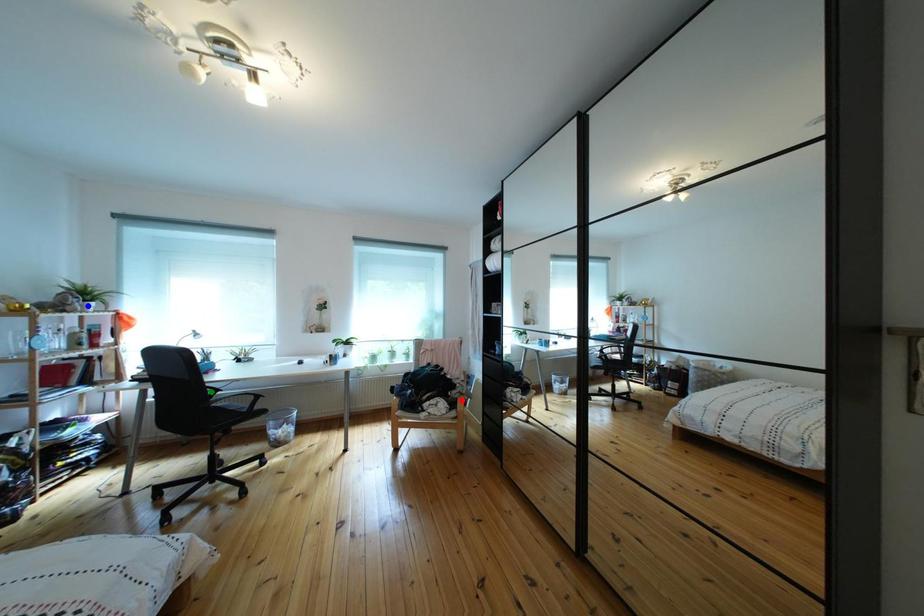
Order these from nearest to farthest:
green point | red point | blue point

blue point < green point < red point